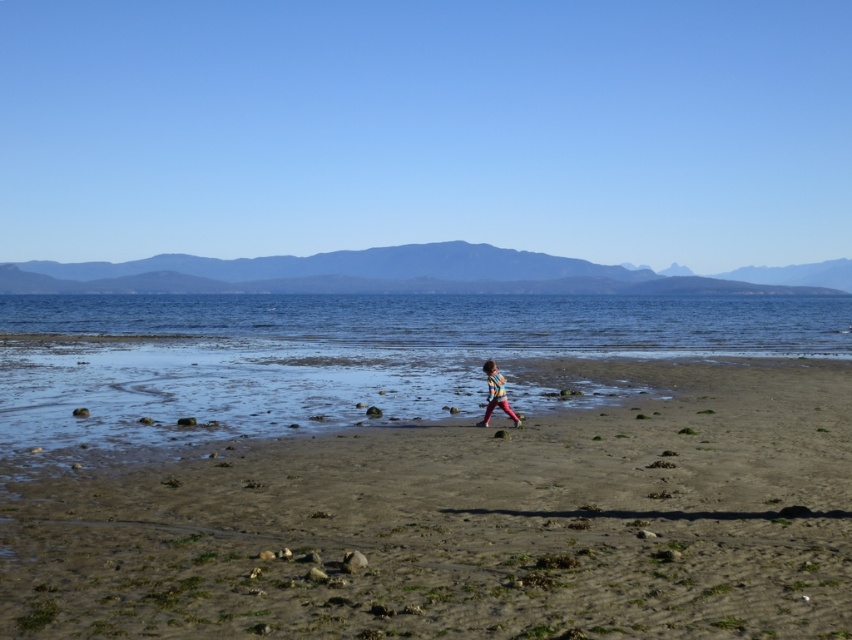
Question: Which of the following is the farthest from the observer?

Choices:
 (A) blue water at lower center
 (B) striped shirt at center
 (C) brown sandy beach at center

Answer: (A)

Question: Estimate the real-world distances between objects in this image. Which object is farther from the striped shirt at center?

Choices:
 (A) blue water at lower center
 (B) brown sandy beach at center

Answer: (A)

Question: Can you confirm if brown sandy beach at center is positioned to the right of striped shirt at center?

Choices:
 (A) no
 (B) yes

Answer: (B)

Question: Which point is closer to the camera?

Choices:
 (A) blue water at lower center
 (B) striped shirt at center

Answer: (B)

Question: Is brown sandy beach at center further to camera compared to striped shirt at center?

Choices:
 (A) yes
 (B) no

Answer: (B)

Question: Can you confirm if brown sandy beach at center is bigger than striped shirt at center?

Choices:
 (A) no
 (B) yes

Answer: (B)